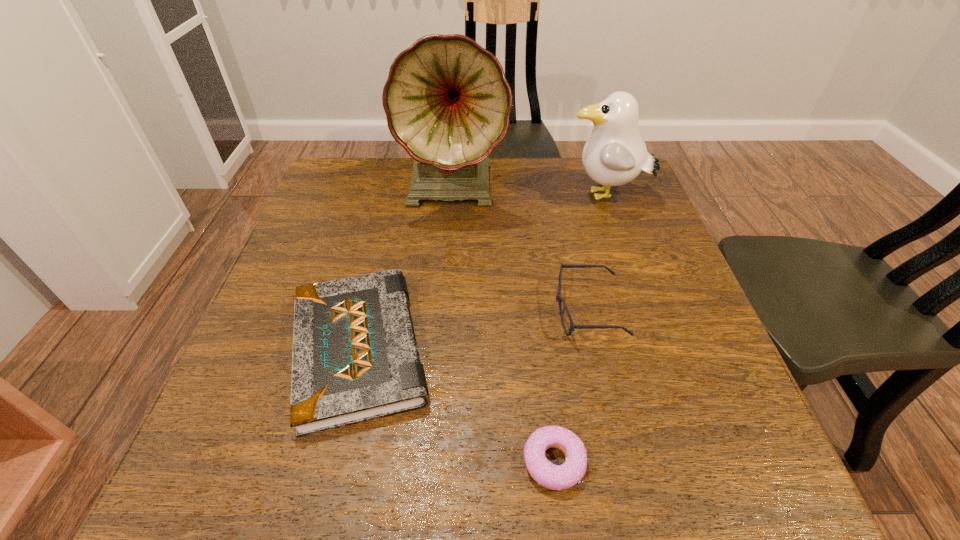
Locate an element on the screen. The image size is (960, 540). blank space located 0.310m on the front-facing side of the spectacles is located at coordinates (401, 310).

Where is `vacant space situated on the front-facing side of the spectacles`? The width and height of the screenshot is (960, 540). vacant space situated on the front-facing side of the spectacles is located at coordinates (475, 310).

You are a GUI agent. You are given a task and a screenshot of the screen. Output one action in this format:
    pyautogui.click(x=<x>, y=<y>)
    Task: Click on the blank space located on the right of the fourth tallest object
    The width and height of the screenshot is (960, 540).
    Given the screenshot: What is the action you would take?
    pyautogui.click(x=540, y=349)

Image resolution: width=960 pixels, height=540 pixels. Identify the location of vacant space located on the back of the doughnut. (544, 379).

This screenshot has width=960, height=540. Identify the location of record player that is positioned at the far edge. (447, 101).

Where is `gull that is at the far edge`? gull that is at the far edge is located at coordinates (615, 154).

Locate an element on the screen. object that is positioned at the near edge is located at coordinates [x=556, y=477].

Where is `object located at the left edge`? This screenshot has width=960, height=540. object located at the left edge is located at coordinates (355, 358).

The image size is (960, 540). I want to click on gull at the right edge, so click(615, 154).

The image size is (960, 540). I want to click on spectacles that is at the right edge, so click(x=572, y=327).